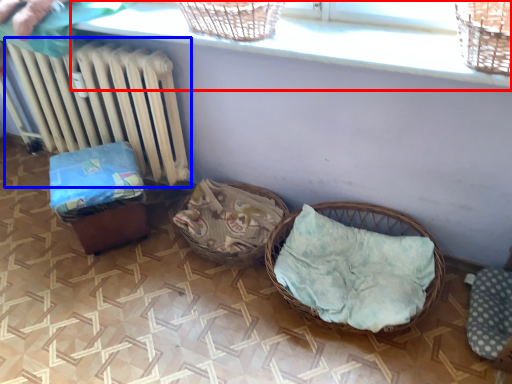
Question: Which point is closer to the camera, window sill (highlighted by a red box) or radiator (highlighted by a blue box)?

Choices:
 (A) window sill
 (B) radiator

Answer: (A)